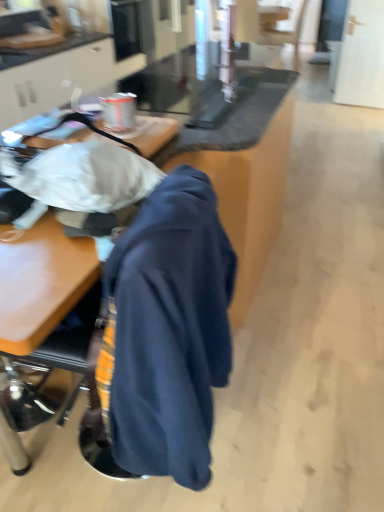
Question: Is navy blue hoodie at center taller or shorter than black leather swivel chair at upper right?

Choices:
 (A) short
 (B) tall

Answer: (A)

Question: Considering the relative positions of navy blue hoodie at center and black leather swivel chair at upper right in the image provided, is navy blue hoodie at center to the left or to the right of black leather swivel chair at upper right?

Choices:
 (A) left
 (B) right

Answer: (A)

Question: Estimate the real-world distances between objects in this image. Which object is closer to the black leather swivel chair at upper right?

Choices:
 (A) wooden table at center
 (B) dark blue fabric at center
 (C) navy blue hoodie at center

Answer: (A)

Question: Estimate the real-world distances between objects in this image. Which object is closer to the wooden table at center?

Choices:
 (A) black leather swivel chair at upper right
 (B) navy blue hoodie at center
 (C) dark blue fabric at center

Answer: (B)